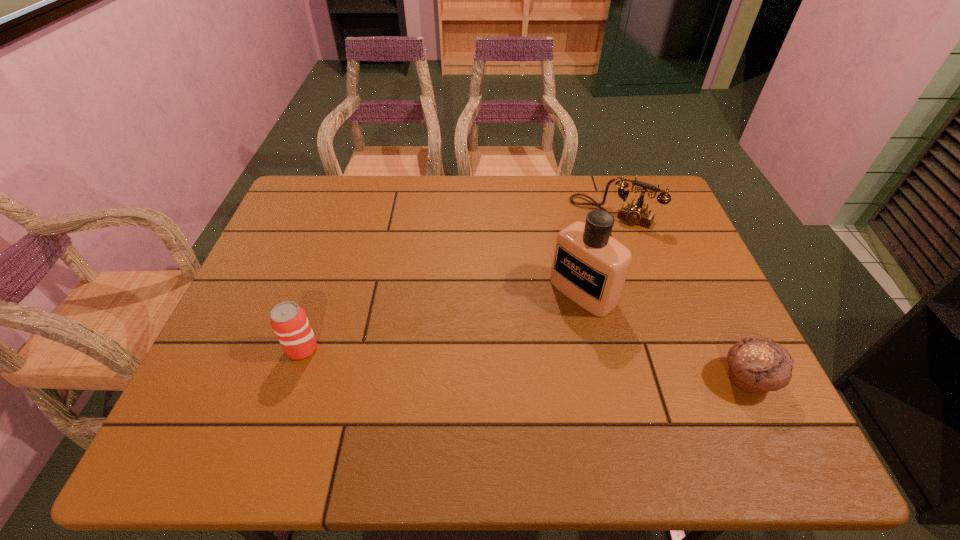
This screenshot has height=540, width=960. Identify the location of the leftmost object. (289, 321).

Image resolution: width=960 pixels, height=540 pixels. Identify the location of the shortest object. (757, 365).

Locate an element on the screen. the farthest object is located at coordinates (636, 213).

Where is `the tallest object`? This screenshot has height=540, width=960. the tallest object is located at coordinates (590, 267).

Locate an element on the screen. the second farthest object is located at coordinates click(x=590, y=267).

I want to click on free space located on the right of the beer can, so click(414, 349).

Identify the location of vacant space located 0.170m on the left of the shortest object. The width and height of the screenshot is (960, 540). (640, 379).

The height and width of the screenshot is (540, 960). I want to click on blank space located 0.080m on the front-facing side of the telephone, so click(585, 242).

Find the location of a particular element. free space located on the front-facing side of the telephone is located at coordinates (560, 279).

Locate an element on the screen. free space located 0.170m on the front-facing side of the telephone is located at coordinates (572, 261).